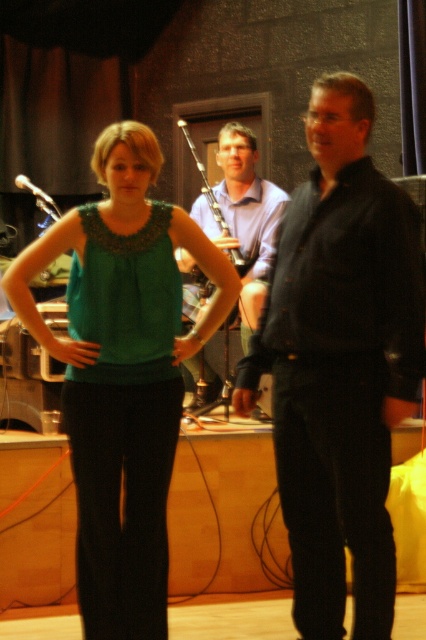
Question: Where is green fabric top at center located in relation to metallic silver microphone at upper left in the image?

Choices:
 (A) below
 (B) above

Answer: (A)

Question: Is green fabric top at center bigger than green fabric dress at center?

Choices:
 (A) yes
 (B) no

Answer: (A)

Question: Where is green fabric top at center located in relation to wooden bagpipe at center in the image?

Choices:
 (A) below
 (B) above

Answer: (A)

Question: Which object appears closest to the camera in this image?

Choices:
 (A) matte wood flute at center
 (B) black textured suit at center
 (C) metallic silver microphone at upper left
 (D) wooden bagpipe at center

Answer: (B)

Question: Which object is farther from the camera taking this photo?

Choices:
 (A) matte wood flute at center
 (B) black textured suit at center

Answer: (A)

Question: Which of the following is the farthest from the observer?

Choices:
 (A) (242, 168)
 (B) (221, 161)

Answer: (B)